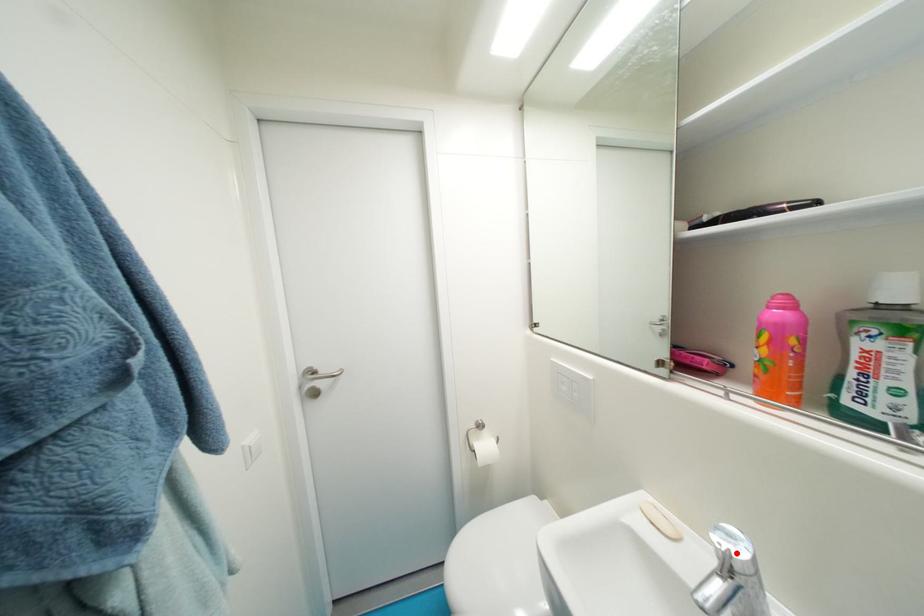
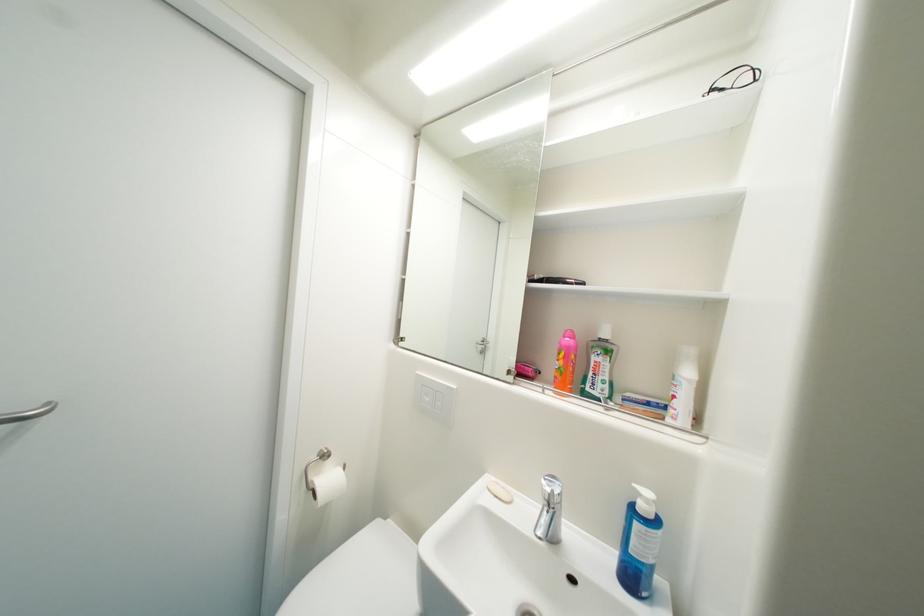
Locate, in the second image, the point that corresponds to the highlighted location in the first image.

(560, 493)